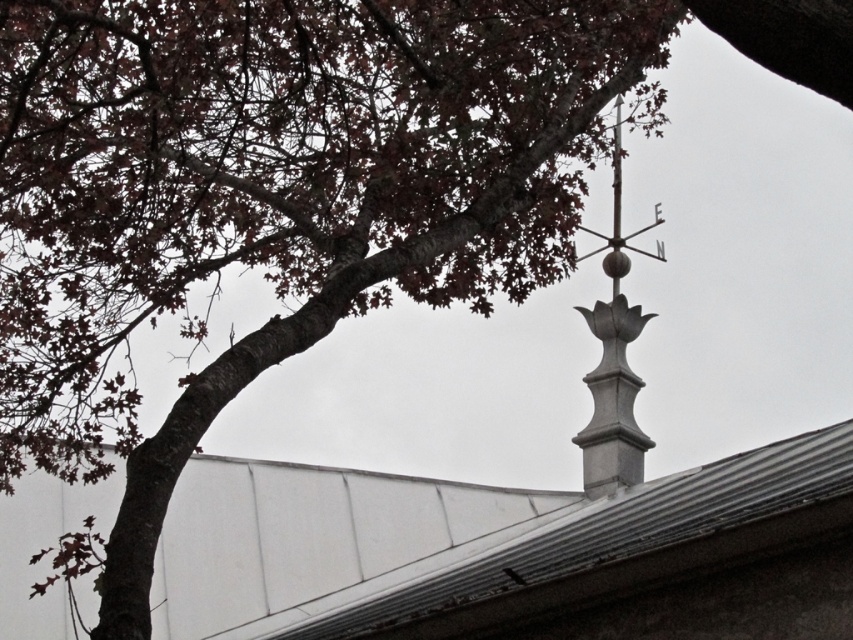
Question: Is white stone spire at upper center closer to camera compared to white polished metal vane at center?

Choices:
 (A) yes
 (B) no

Answer: (A)

Question: Which of the following is the farthest from the observer?

Choices:
 (A) white stone spire at upper center
 (B) white polished metal vane at center

Answer: (B)

Question: Is white stone spire at upper center below white polished metal vane at center?

Choices:
 (A) no
 (B) yes

Answer: (B)

Question: Does white stone spire at upper center have a smaller size compared to white polished metal vane at center?

Choices:
 (A) no
 (B) yes

Answer: (A)

Question: Which object is farther from the camera taking this photo?

Choices:
 (A) white stone spire at upper center
 (B) white polished metal vane at center

Answer: (B)